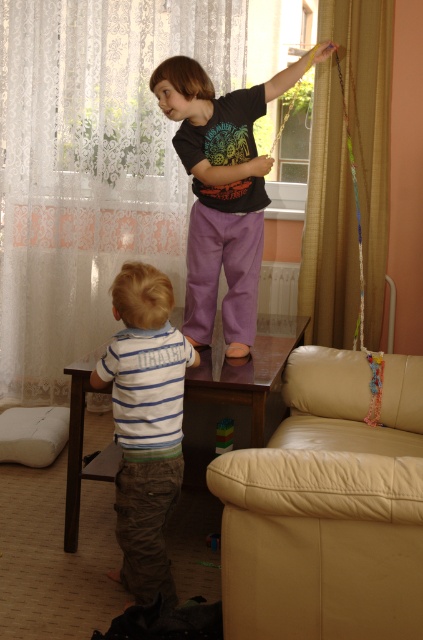
Question: Does white lace curtain at upper left appear on the right side of multicolored plastic blocks at lower center?

Choices:
 (A) yes
 (B) no

Answer: (B)

Question: Can you confirm if gold textured curtain at upper right is bigger than white foam cushion at lower left?

Choices:
 (A) yes
 (B) no

Answer: (A)

Question: Which object appears closest to the camera in this image?

Choices:
 (A) gold textured curtain at upper right
 (B) white striped shirt at lower left
 (C) matte black t-shirt at upper center

Answer: (B)

Question: Based on their relative distances, which object is nearer to the wooden toy at lower center?

Choices:
 (A) multicolored plastic blocks at lower center
 (B) white lace curtain at upper left
 (C) white striped shirt at lower left

Answer: (A)

Question: Observing the image, what is the correct spatial positioning of white striped shirt at lower left in reference to multicolored plastic blocks at lower center?

Choices:
 (A) left
 (B) right

Answer: (A)

Question: Considering the real-world distances, which object is closest to the multicolored plastic blocks at lower center?

Choices:
 (A) white striped shirt at lower left
 (B) brown wooden side table at center
 (C) matte black t-shirt at upper center
 (D) wooden toy at lower center

Answer: (B)